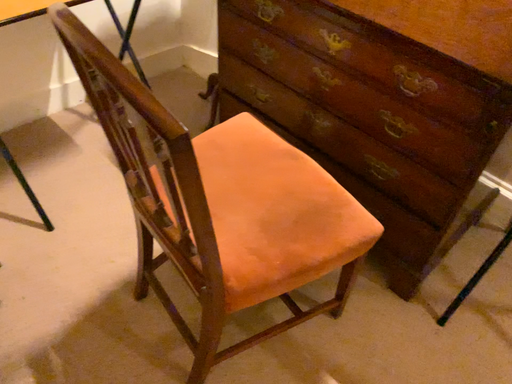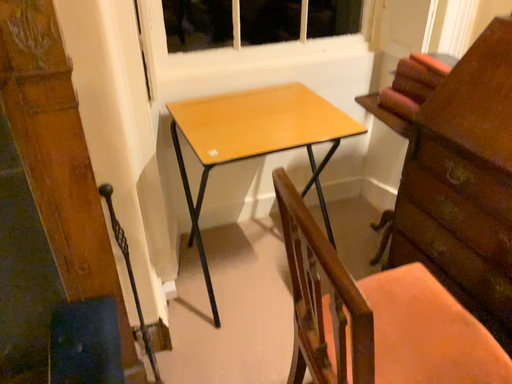
Question: Which way did the camera rotate in the video?

Choices:
 (A) rotated left
 (B) rotated right

Answer: (A)